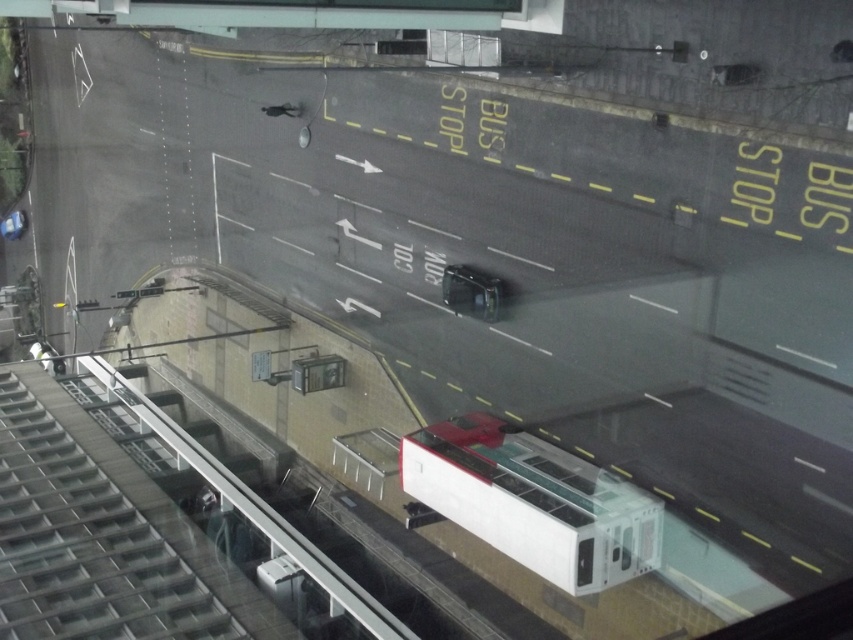
Question: Which point appears farthest from the camera in this image?

Choices:
 (A) (642, 515)
 (B) (462, 285)

Answer: (B)

Question: Does white plastic train at center appear on the right side of shiny silver car at center?

Choices:
 (A) yes
 (B) no

Answer: (A)

Question: Is white plastic train at center bigger than shiny silver car at center?

Choices:
 (A) no
 (B) yes

Answer: (B)

Question: Among these points, which one is nearest to the camera?

Choices:
 (A) tap(456, 268)
 (B) tap(471, 504)

Answer: (B)

Question: From the image, what is the correct spatial relationship of white plastic train at center in relation to shiny silver car at center?

Choices:
 (A) below
 (B) above

Answer: (A)